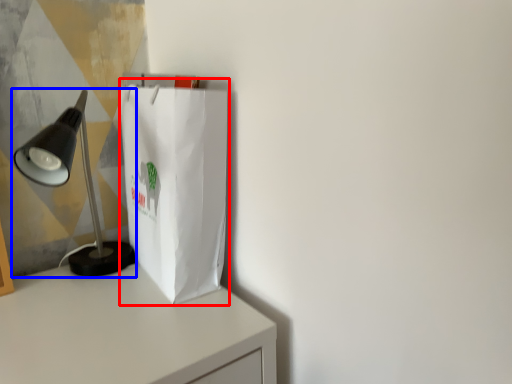
Question: Which point is further to the camera, grocery bag (highlighted by a red box) or lamp (highlighted by a blue box)?

Choices:
 (A) grocery bag
 (B) lamp

Answer: (A)